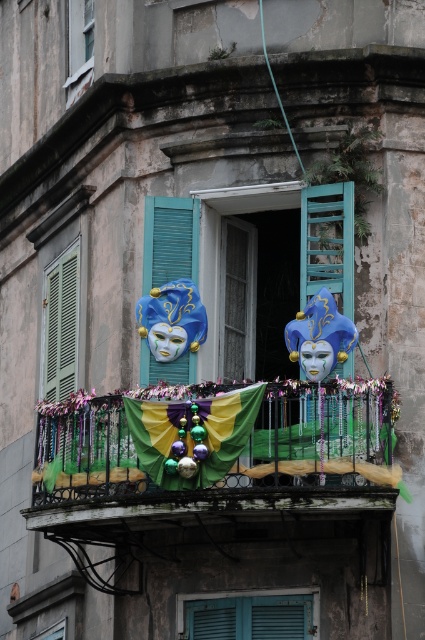
Question: In this image, where is teal matte shutters at lower center located relative to blue painted wood at center?

Choices:
 (A) above
 (B) below

Answer: (B)

Question: Which of the following is the farthest from the observer?

Choices:
 (A) (156, 211)
 (B) (178, 612)
 (C) (42, 636)
 (D) (351, 426)

Answer: (C)

Question: Can you confirm if shiny metallic banner at center is positioned below blue painted wood at center?

Choices:
 (A) yes
 (B) no

Answer: (A)

Question: Which is nearer to the blue painted wood at center?

Choices:
 (A) shiny metallic banner at center
 (B) matte glass window at upper left

Answer: (A)

Question: Can you confirm if blue painted wood at center is positioned above matte glass window at upper left?

Choices:
 (A) yes
 (B) no

Answer: (B)

Question: Which point is farther from the camera taking this photo?

Choices:
 (A) (73, 26)
 (B) (54, 634)
 (C) (325, 486)
 (D) (156, 198)

Answer: (A)